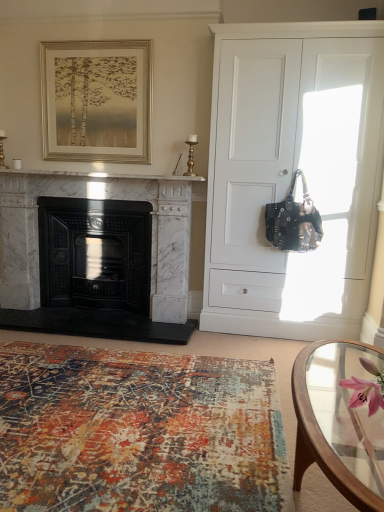
Question: From a real-world perspective, is clear glass coffee table at lower right positioned under gold-toned wooden frame at upper center based on gravity?

Choices:
 (A) no
 (B) yes

Answer: (B)

Question: Is gold-toned wooden frame at upper center inside clear glass coffee table at lower right?

Choices:
 (A) no
 (B) yes

Answer: (A)

Question: From the image's perspective, is clear glass coffee table at lower right below gold-toned wooden frame at upper center?

Choices:
 (A) yes
 (B) no

Answer: (A)

Question: Is clear glass coffee table at lower right far away from gold-toned wooden frame at upper center?

Choices:
 (A) yes
 (B) no

Answer: (A)

Question: Considering the relative positions of clear glass coffee table at lower right and gold-toned wooden frame at upper center in the image provided, is clear glass coffee table at lower right to the right of gold-toned wooden frame at upper center from the viewer's perspective?

Choices:
 (A) no
 (B) yes

Answer: (B)

Question: Is white matte cabinet at right inside the boundaries of black cast iron fireplace at left, which is counted as the 2th fireplace, starting from the right, or outside?

Choices:
 (A) outside
 (B) inside

Answer: (A)

Question: Considering the positions of white matte cabinet at right and black cast iron fireplace at left, which is counted as the 2th fireplace, starting from the right, in the image, is white matte cabinet at right bigger or smaller than black cast iron fireplace at left, which is counted as the 2th fireplace, starting from the right,?

Choices:
 (A) big
 (B) small

Answer: (A)

Question: From a real-world perspective, is white matte cabinet at right above or below black cast iron fireplace at left, which is the 1th fireplace in left-to-right order?

Choices:
 (A) above
 (B) below

Answer: (A)

Question: Would you say white matte cabinet at right is to the left or to the right of black cast iron fireplace at left, which is counted as the 2th fireplace, starting from the right, in the picture?

Choices:
 (A) right
 (B) left

Answer: (A)

Question: Does point (1, 249) appear closer or farther from the camera than point (306, 138)?

Choices:
 (A) farther
 (B) closer

Answer: (A)

Question: Looking at the image, does white marble fireplace at left, the second fireplace positioned from the left, seem bigger or smaller compared to white matte cabinet at right?

Choices:
 (A) big
 (B) small

Answer: (B)

Question: From the image's perspective, is white marble fireplace at left, the second fireplace positioned from the left, above or below white matte cabinet at right?

Choices:
 (A) above
 (B) below

Answer: (B)

Question: In terms of height, does white marble fireplace at left, the second fireplace positioned from the left, look taller or shorter compared to white matte cabinet at right?

Choices:
 (A) tall
 (B) short

Answer: (B)

Question: From the image's perspective, is textured rug at lower left positioned above or below gold-toned wooden frame at upper center?

Choices:
 (A) below
 (B) above

Answer: (A)

Question: Based on their positions, is textured rug at lower left located to the left or right of gold-toned wooden frame at upper center?

Choices:
 (A) left
 (B) right

Answer: (B)